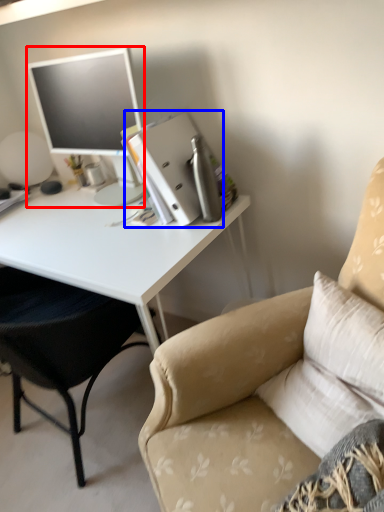
Question: Which object is further to the camera taking this photo, television (highlighted by a red box) or binder (highlighted by a blue box)?

Choices:
 (A) television
 (B) binder

Answer: (B)